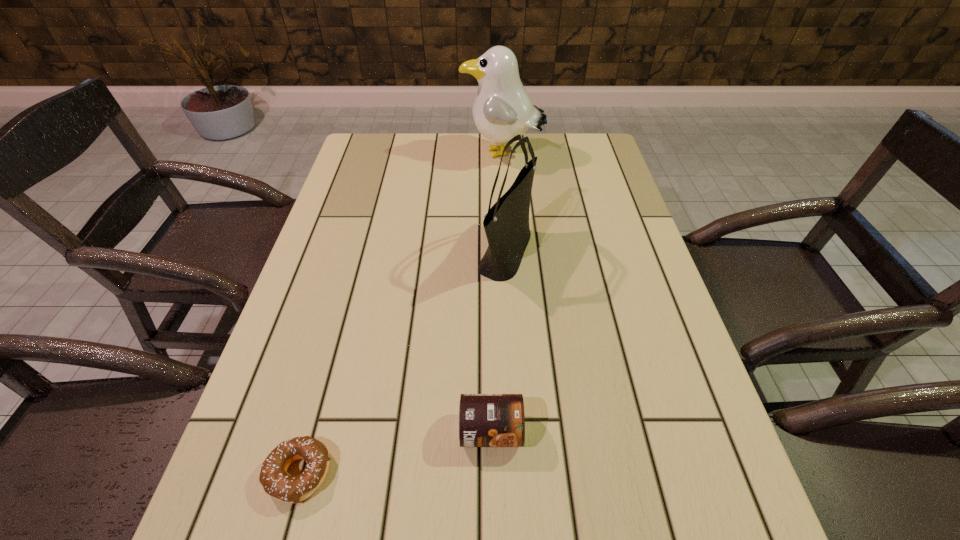
In order to click on vacant space situated 0.270m on the right of the shortest object in this screenshot , I will do `click(493, 474)`.

At what (x,y) coordinates should I click in order to perform the action: click on object that is at the far edge. Please return your answer as a coordinate pair (x, y). Looking at the image, I should click on click(x=502, y=109).

Identify the location of object located at the left edge. The image size is (960, 540). (276, 482).

This screenshot has height=540, width=960. What are the coordinates of `vacant space at the far edge` in the screenshot? It's located at (398, 172).

At what (x,y) coordinates should I click in order to perform the action: click on vacant space at the left edge of the desktop. Please return your answer as a coordinate pair (x, y). The image size is (960, 540). Looking at the image, I should click on (354, 190).

Where is `vacant region at the right edge of the desktop`? vacant region at the right edge of the desktop is located at coordinates (610, 234).

Image resolution: width=960 pixels, height=540 pixels. In order to click on vacant space at the far left corner of the desktop in this screenshot , I will do `click(386, 150)`.

In order to click on vacant space at the far right corner in this screenshot , I will do `click(588, 139)`.

Image resolution: width=960 pixels, height=540 pixels. In order to click on vacant area that lies between the gull and the third tallest object in this screenshot , I will do `click(496, 293)`.

You are a GUI agent. You are given a task and a screenshot of the screen. Output one action in this format:
    pyautogui.click(x=<x>, y=<y>)
    Task: Click on the vacant region between the leftmost object and the second shortest object
    
    Given the screenshot: What is the action you would take?
    pyautogui.click(x=395, y=453)